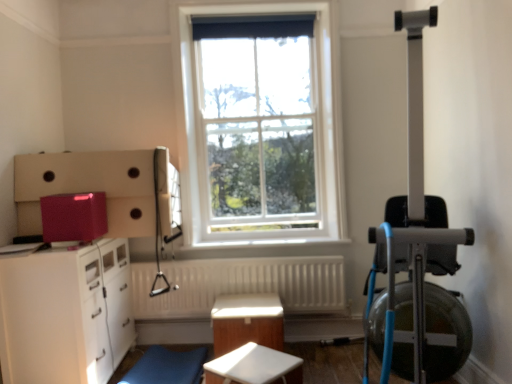
At what (x,y) coordinates should I click in order to perform the action: click on vacant region above white textured radiator at center (from a real-world perspective). Please return your answer as a coordinate pair (x, y). The image size is (512, 384). Looking at the image, I should click on (247, 256).